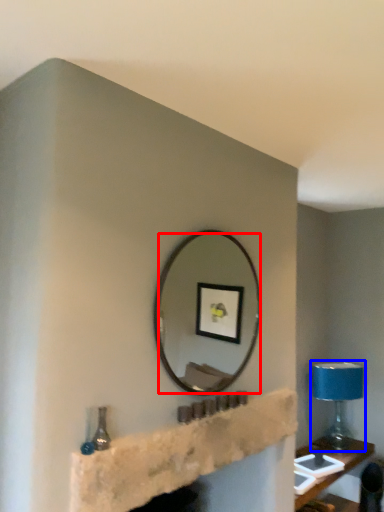
Question: Which object is closer to the camera taking this photo, mirror (highlighted by a red box) or table lamp (highlighted by a blue box)?

Choices:
 (A) mirror
 (B) table lamp

Answer: (A)